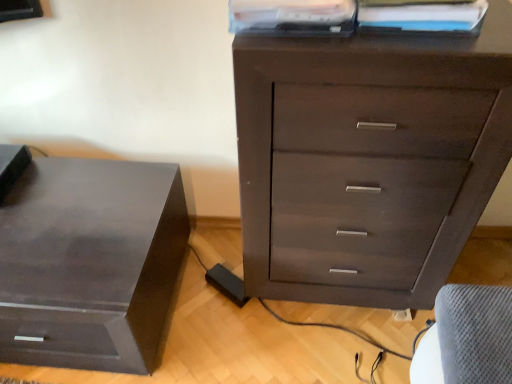
Question: Does matte plastic book at upper center, which is the first book in left-to-right order, come behind matte black nightstand at left?

Choices:
 (A) no
 (B) yes

Answer: (A)

Question: Is matte plastic book at upper center, which is the first book in left-to-right order, smaller than matte black nightstand at left?

Choices:
 (A) yes
 (B) no

Answer: (A)

Question: From the image's perspective, would you say matte plastic book at upper center, the 2th book in the right-to-left sequence, is shown under matte black nightstand at left?

Choices:
 (A) no
 (B) yes

Answer: (A)

Question: Does matte plastic book at upper center, the 2th book in the right-to-left sequence, have a lesser height compared to matte black nightstand at left?

Choices:
 (A) yes
 (B) no

Answer: (A)

Question: Is matte plastic book at upper center, which is the first book in left-to-right order, taller than matte black nightstand at left?

Choices:
 (A) no
 (B) yes

Answer: (A)

Question: Is dark wood chest of drawers at center bigger or smaller than matte plastic book at upper center, the 2th book in the right-to-left sequence?

Choices:
 (A) big
 (B) small

Answer: (A)

Question: From their relative heights in the image, would you say dark wood chest of drawers at center is taller or shorter than matte plastic book at upper center, the 2th book in the right-to-left sequence?

Choices:
 (A) short
 (B) tall

Answer: (B)

Question: From the image's perspective, is dark wood chest of drawers at center above or below matte plastic book at upper center, the 2th book in the right-to-left sequence?

Choices:
 (A) above
 (B) below

Answer: (B)

Question: Is point (347, 102) closer or farther from the camera than point (232, 6)?

Choices:
 (A) closer
 (B) farther

Answer: (B)

Question: Is matte plastic book at upper center, which is the first book in left-to-right order, in front of or behind white paper at upper center, positioned as the first book in right-to-left order, in the image?

Choices:
 (A) front
 (B) behind

Answer: (A)

Question: Looking at their shapes, would you say matte plastic book at upper center, which is the first book in left-to-right order, is wider or thinner than white paper at upper center, the second book viewed from the left?

Choices:
 (A) thin
 (B) wide

Answer: (B)

Question: From the image's perspective, is matte plastic book at upper center, the 2th book in the right-to-left sequence, positioned above or below white paper at upper center, positioned as the first book in right-to-left order?

Choices:
 (A) above
 (B) below

Answer: (A)

Question: From their relative heights in the image, would you say matte plastic book at upper center, the 2th book in the right-to-left sequence, is taller or shorter than white paper at upper center, the second book viewed from the left?

Choices:
 (A) tall
 (B) short

Answer: (A)

Question: Is dark wood chest of drawers at center taller or shorter than white paper at upper center, the second book viewed from the left?

Choices:
 (A) tall
 (B) short

Answer: (A)

Question: Considering their positions, is dark wood chest of drawers at center located in front of or behind white paper at upper center, positioned as the first book in right-to-left order?

Choices:
 (A) front
 (B) behind

Answer: (A)